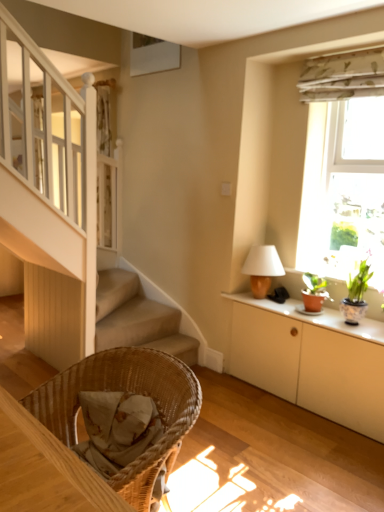
Find the location of `white matte cabinet at right`. white matte cabinet at right is located at coordinates (311, 361).

This screenshot has height=512, width=384. What do you see at coordinates (262, 268) in the screenshot? I see `matte brown table lamp at upper right` at bounding box center [262, 268].

Identify the location of white matte cabinet at right. This screenshot has height=512, width=384. (311, 361).

Is the depth of translucent fabric curtain at upper right less than that of woven wood chair at lower left?

No, translucent fabric curtain at upper right is behind woven wood chair at lower left.

Is translucent fabric curtain at upper right wider or thinner than woven wood chair at lower left?

Clearly, translucent fabric curtain at upper right has less width compared to woven wood chair at lower left.

Does matte brown table lamp at upper right have a greater height compared to white matte cabinet at right?

No, matte brown table lamp at upper right is not taller than white matte cabinet at right.

This screenshot has height=512, width=384. Identify the location of cabinetry that appears on the right of matte brown table lamp at upper right. (311, 361).

Based on the photo, which of these two, matte brown table lamp at upper right or white matte cabinet at right, is wider?

white matte cabinet at right is wider.

How different are the orientations of matte brown table lamp at upper right and white matte cabinet at right in degrees?

There is a 0.000598-degree angle between the facing directions of matte brown table lamp at upper right and white matte cabinet at right.

From a real-world perspective, is woven wood chair at lower left over translucent fabric curtain at upper right?

No, from a real-world perspective, woven wood chair at lower left is not over translucent fabric curtain at upper right

Consider the image. Does woven wood chair at lower left have a larger size compared to translucent fabric curtain at upper right?

Yes, woven wood chair at lower left is bigger than translucent fabric curtain at upper right.

Is woven wood chair at lower left thinner than translucent fabric curtain at upper right?

Incorrect, the width of woven wood chair at lower left is not less than that of translucent fabric curtain at upper right.

Is woven wood chair at lower left in front of translucent fabric curtain at upper right?

Yes.

From the picture: Relative to translucent fabric curtain at upper right, is matte white cabinet at right in front or behind?

matte white cabinet at right is positioned closer to the viewer than translucent fabric curtain at upper right.

Locate an element on the screen. Image resolution: width=384 pixels, height=512 pixels. window sill that is below the translucent fabric curtain at upper right (from the image's perspective) is located at coordinates (316, 317).

Is point (306, 318) in front of point (364, 167)?

That is True.

Which object is positioned more to the left, matte white cabinet at right or translucent fabric curtain at upper right?

Positioned to the left is matte white cabinet at right.

Is woven wood chair at lower left shorter than matte white cabinet at right?

No.

What's the angular difference between woven wood chair at lower left and matte white cabinet at right's facing directions?

0.000159 degrees separate the facing orientations of woven wood chair at lower left and matte white cabinet at right.

From the image's perspective, is woven wood chair at lower left on matte white cabinet at right?

Incorrect, from the image's perspective, woven wood chair at lower left is lower than matte white cabinet at right.

Is woven wood chair at lower left placed right next to matte white cabinet at right?

woven wood chair at lower left and matte white cabinet at right are not in contact.

Considering the positions of objects woven wood chair at lower left and white matte cabinet at right in the image provided, who is more to the right, woven wood chair at lower left or white matte cabinet at right?

white matte cabinet at right is more to the right.

From a real-world perspective, is woven wood chair at lower left physically located above or below white matte cabinet at right?

Clearly, from a real-world perspective, woven wood chair at lower left is above white matte cabinet at right.

Considering the sizes of objects woven wood chair at lower left and white matte cabinet at right in the image provided, who is shorter, woven wood chair at lower left or white matte cabinet at right?

With less height is white matte cabinet at right.

Does woven wood chair at lower left turn towards white matte cabinet at right?

No, woven wood chair at lower left does not turn towards white matte cabinet at right.

From a real-world perspective, which object rests below the other?

translucent fabric curtain at upper right is physically lower.

Which object is further away from the camera taking this photo, green floral fabric at upper right or translucent fabric curtain at upper right?

green floral fabric at upper right is further away from the camera.

Considering the sizes of green floral fabric at upper right and translucent fabric curtain at upper right in the image, is green floral fabric at upper right bigger or smaller than translucent fabric curtain at upper right?

green floral fabric at upper right is smaller than translucent fabric curtain at upper right.

Find the location of a particular element. The image size is (384, 512). window below the green floral fabric at upper right (from a real-world perspective) is located at coordinates (343, 188).

You are a GUI agent. You are given a task and a screenshot of the screen. Output one action in this format:
    pyautogui.click(x=<x>, y=<y>)
    Task: Click on the window positioned vertically above the woven wood chair at lower left (from a real-world perspective)
    
    Given the screenshot: What is the action you would take?
    pyautogui.click(x=343, y=188)

Where is `cabinetry on the right of matte brown table lamp at upper right`? Image resolution: width=384 pixels, height=512 pixels. cabinetry on the right of matte brown table lamp at upper right is located at coordinates (311, 361).

Considering their positions, is white matte cabinet at right positioned further to matte brown table lamp at upper right than green floral fabric at upper right?

green floral fabric at upper right lies further to matte brown table lamp at upper right than the other object.

Estimate the real-world distances between objects in this image. Which object is closer to white matte cabinet at right, translucent fabric curtain at upper right or matte white cabinet at right?

matte white cabinet at right is closer to white matte cabinet at right.

Which object lies nearer to the anchor point green floral fabric at upper right, woven wood chair at lower left or matte brown table lamp at upper right?

matte brown table lamp at upper right is closer to green floral fabric at upper right.

Looking at the image, which one is located further to woven wood chair at lower left, translucent fabric curtain at upper right or matte white cabinet at right?

The object further to woven wood chair at lower left is translucent fabric curtain at upper right.

Estimate the real-world distances between objects in this image. Which object is further from green floral fabric at upper right, translucent fabric curtain at upper right or white matte cabinet at right?

white matte cabinet at right is positioned further to the anchor green floral fabric at upper right.

From the picture: Considering their positions, is translucent fabric curtain at upper right positioned further to woven wood chair at lower left than matte brown table lamp at upper right?

translucent fabric curtain at upper right lies further to woven wood chair at lower left than the other object.

Considering their positions, is translucent fabric curtain at upper right positioned closer to matte brown table lamp at upper right than green floral fabric at upper right?

The object closer to matte brown table lamp at upper right is translucent fabric curtain at upper right.

From the image, which object appears to be nearer to green floral fabric at upper right, matte white cabinet at right or woven wood chair at lower left?

matte white cabinet at right lies closer to green floral fabric at upper right than the other object.

Locate an element on the screen. This screenshot has width=384, height=512. window sill between woven wood chair at lower left and translucent fabric curtain at upper right from front to back is located at coordinates (316, 317).

The image size is (384, 512). Identify the location of window sill between green floral fabric at upper right and white matte cabinet at right vertically. (316, 317).

At what (x,y) coordinates should I click in order to perform the action: click on window sill between green floral fabric at upper right and woven wood chair at lower left from top to bottom. Please return your answer as a coordinate pair (x, y). This screenshot has width=384, height=512. Looking at the image, I should click on (316, 317).

The image size is (384, 512). I want to click on cabinetry located between woven wood chair at lower left and translucent fabric curtain at upper right in the depth direction, so click(311, 361).